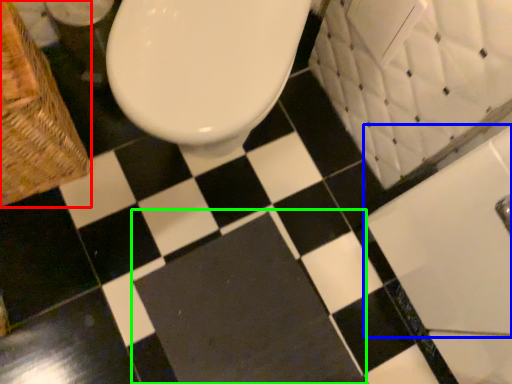
Question: Which object is positioned closest to basket (highlighted by a red box)? Select from bath (highlighted by a blue box) and bath mat (highlighted by a green box).

Choices:
 (A) bath
 (B) bath mat

Answer: (B)